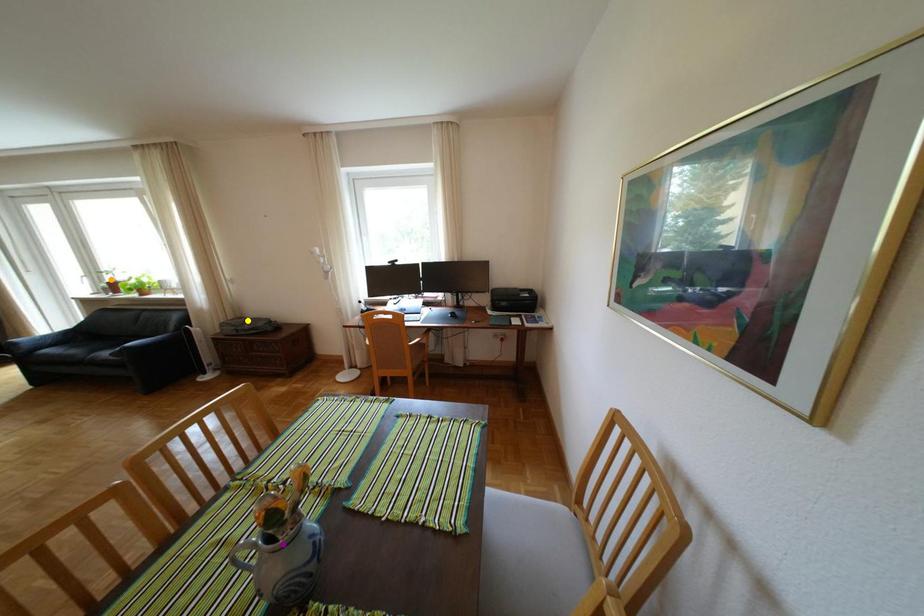
Order these from nearest to farthest:
- purple point
- yellow point
- orange point

purple point
yellow point
orange point